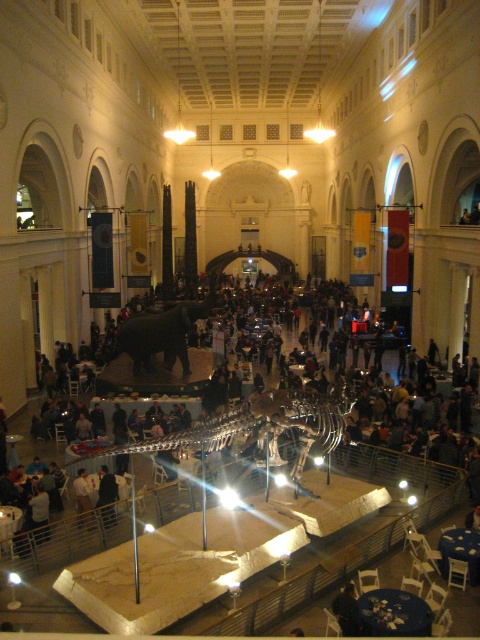
Does shiny metallic dinosaur skeleton at center appear on the left side of dark blue fabric at center?

Correct, you'll find shiny metallic dinosaur skeleton at center to the left of dark blue fabric at center.

Can you confirm if shiny metallic dinosaur skeleton at center is shorter than dark blue fabric at center?

No.

Identify the location of shiny metallic dinosaur skeleton at center. (232, 426).

Is shiny metallic dinosaur skeleton at center below shiny black elephant at center?

Correct, shiny metallic dinosaur skeleton at center is located below shiny black elephant at center.

At what (x,y) coordinates should I click in order to perform the action: click on shiny metallic dinosaur skeleton at center. Please return your answer as a coordinate pair (x, y). The width and height of the screenshot is (480, 640). Looking at the image, I should click on (232, 426).

Consider the image. Who is more distant from viewer, (186, 310) or (336, 609)?

Point (186, 310)

At what (x,y) coordinates should I click in order to perform the action: click on shiny black elephant at center. Please return your answer as a coordinate pair (x, y). The height and width of the screenshot is (640, 480). Looking at the image, I should click on pos(160,333).

I want to click on shiny black elephant at center, so click(160, 333).